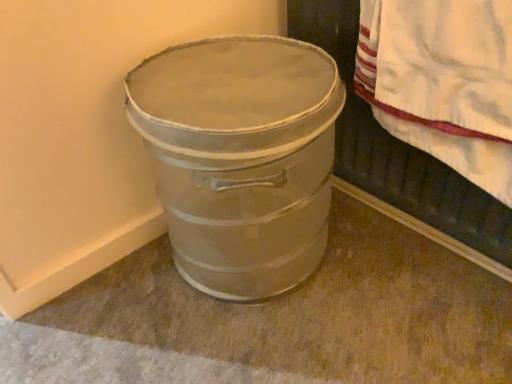
At what (x,y) coordinates should I click in order to perform the action: click on free space in front of metallic gray bucket at lower left. Please return your answer as a coordinate pair (x, y). The image size is (512, 384). Looking at the image, I should click on pyautogui.click(x=268, y=344).